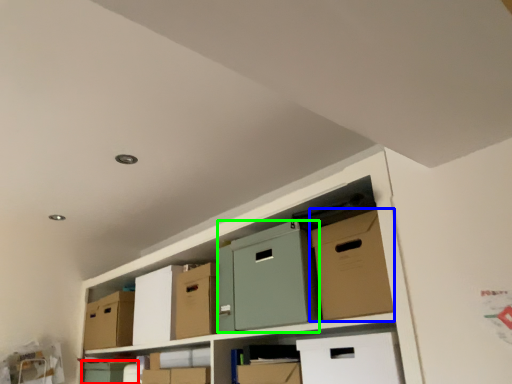
Question: Based on their relative distances, which object is nearer to box (highlighted by a red box)? Choose from cardboard box (highlighted by a blue box) and wide (highlighted by a green box).

Choices:
 (A) cardboard box
 (B) wide

Answer: (B)